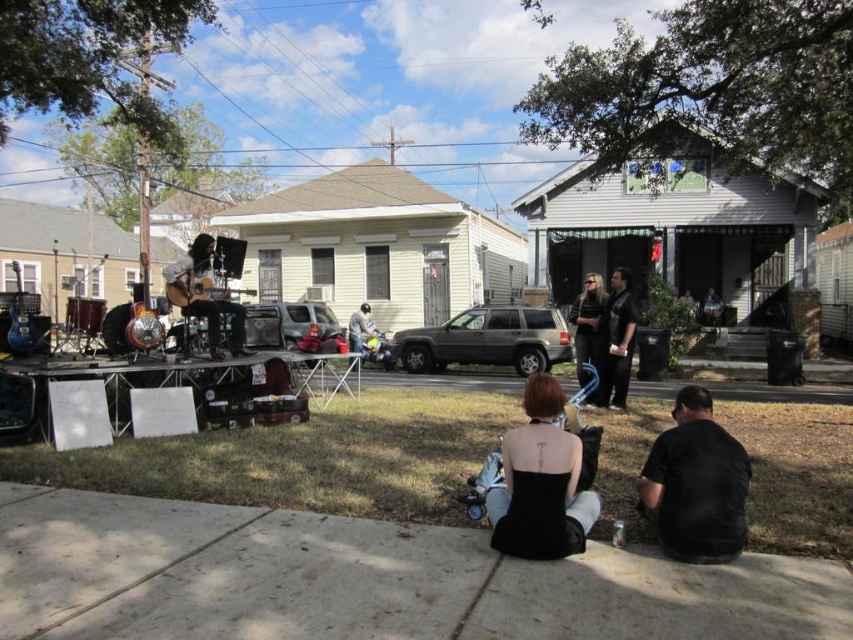
You are standing at the point marked as point (532,598) and want to move to the stage. The distance between you and the stage is 10 feet. Can you safely walk to the stage without needing to move any obstacles?

The distance between point (532,598) and the viewer is 11.82 feet, which is greater than the 10 feet distance to the stage. Therefore, you can safely walk to the stage without needing to move any obstacles as you are closer to the stage than your current position.